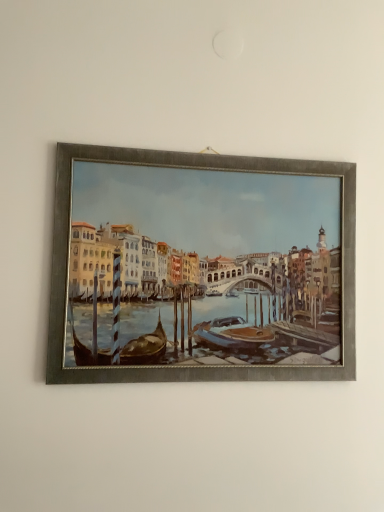
Question: Should I look upward or downward to see metallic silver frame at center?

Choices:
 (A) down
 (B) up

Answer: (A)